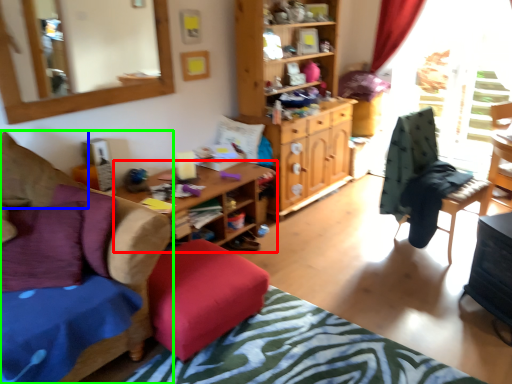
Question: Which is nearer to the desk (highlighted by a red box)? pillow (highlighted by a blue box) or chair (highlighted by a green box).

Choices:
 (A) pillow
 (B) chair

Answer: (A)